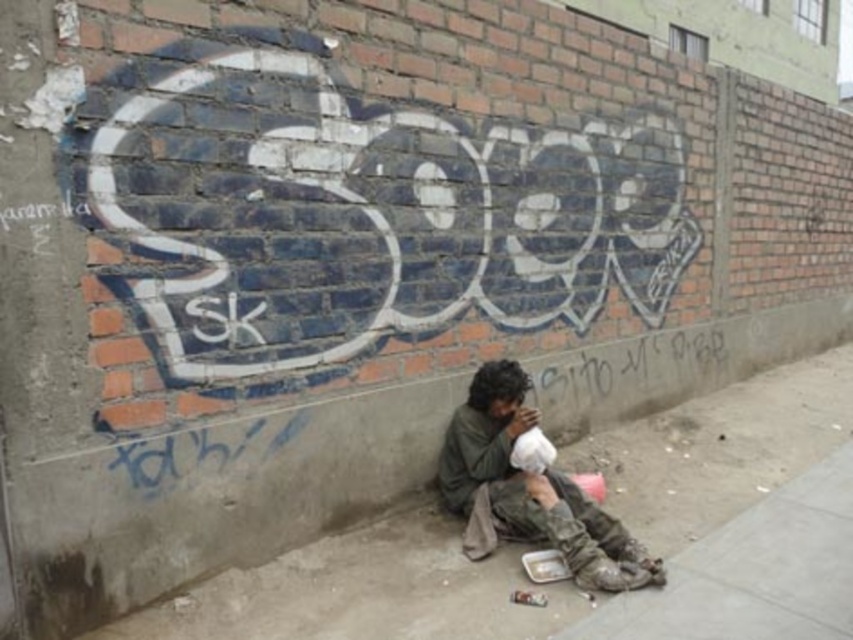
Question: Where is concrete pavement at lower center located in relation to dirty green jacket at lower center in the image?

Choices:
 (A) right
 (B) left

Answer: (A)

Question: Is concrete pavement at lower center positioned behind dirty green jacket at lower center?

Choices:
 (A) yes
 (B) no

Answer: (A)

Question: Which point is farther from the camera taking this photo?

Choices:
 (A) (634, 458)
 (B) (471, 412)

Answer: (A)

Question: Considering the relative positions of concrete pavement at lower center and dirty green jacket at lower center in the image provided, where is concrete pavement at lower center located with respect to dirty green jacket at lower center?

Choices:
 (A) left
 (B) right

Answer: (B)